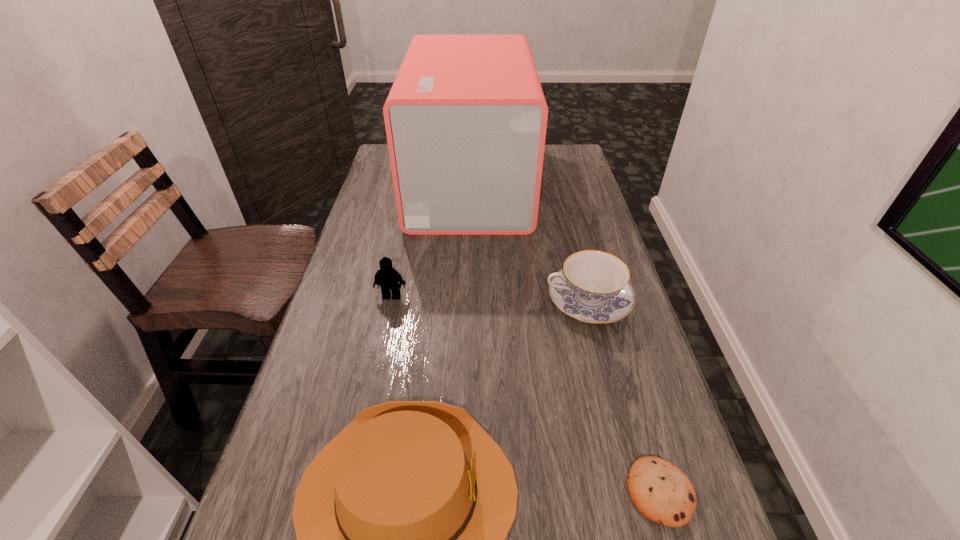
Identify the location of vacant area that satisfies the following two spatial constraints: 1. on the surface of the farthest object where the text is embossed; 2. on the left side of the cookie. (461, 492).

The height and width of the screenshot is (540, 960). Find the location of `blank area in the image that satisfies the following two spatial constraints: 1. on the face of the Lego; 2. with the handle on the side of the chinaware`. blank area in the image that satisfies the following two spatial constraints: 1. on the face of the Lego; 2. with the handle on the side of the chinaware is located at coordinates (391, 301).